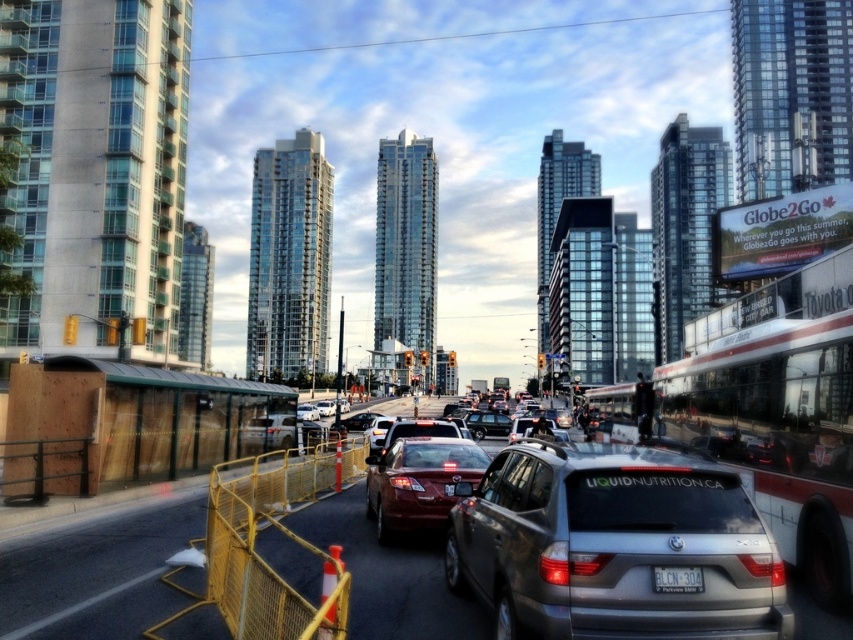
Question: Which point appears closest to the camera in this image?

Choices:
 (A) (698, 573)
 (B) (544, 477)
 (C) (367, 493)
 (D) (476, 412)

Answer: (A)

Question: Observing the image, what is the correct spatial positioning of shiny red sedan at center in reference to shiny black sedan at center?

Choices:
 (A) above
 (B) below

Answer: (A)

Question: Is shiny red sedan at center bigger than white plastic license plate at center?

Choices:
 (A) no
 (B) yes

Answer: (B)

Question: Is the position of shiny red sedan at center more distant than that of white plastic license plate at center?

Choices:
 (A) yes
 (B) no

Answer: (A)

Question: Which point is closer to the camera taking this photo?

Choices:
 (A) (486, 589)
 (B) (425, 461)
 (C) (653, 577)

Answer: (C)

Question: Which point is farther to the camera?

Choices:
 (A) satin silver suv at center
 (B) shiny red sedan at center
 (C) white plastic license plate at center
 (D) shiny black sedan at center

Answer: (D)